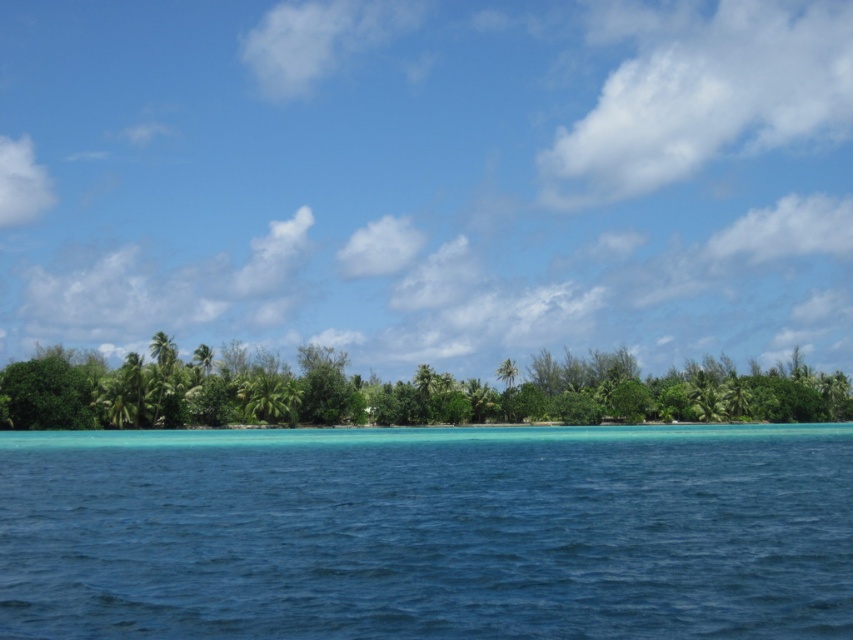
Question: Observing the image, what is the correct spatial positioning of green leafy trees at center in reference to green leafy palm tree at center?

Choices:
 (A) left
 (B) right

Answer: (B)

Question: Does clear blue water at center have a greater width compared to green leafy palm tree at center?

Choices:
 (A) yes
 (B) no

Answer: (A)

Question: Which point is closer to the camera taking this photo?

Choices:
 (A) (228, 365)
 (B) (294, 388)

Answer: (B)

Question: Which is nearer to the green leafy palm tree at center?

Choices:
 (A) green leafy trees at center
 (B) clear blue water at center

Answer: (A)

Question: Can you confirm if clear blue water at center is positioned below green leafy palm tree at center?

Choices:
 (A) yes
 (B) no

Answer: (B)

Question: Which of the following is the farthest from the observer?

Choices:
 (A) (283, 413)
 (B) (328, 388)
 (C) (558, 616)

Answer: (B)